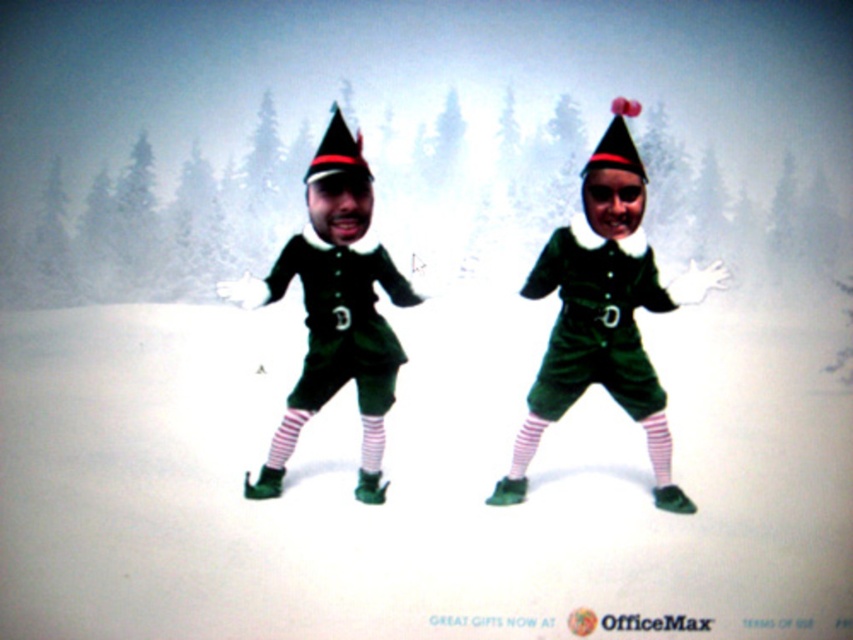
Question: Among these objects, which one is farthest from the camera?

Choices:
 (A) matte black christmas hat at upper center
 (B) white matte snow at center
 (C) green velvet elf at center

Answer: (C)

Question: Where is green velvet elf at center located in relation to matte green fabric christmas hat at center in the image?

Choices:
 (A) right
 (B) left

Answer: (A)

Question: Does green velvet elf at center have a lesser width compared to matte green fabric christmas hat at center?

Choices:
 (A) no
 (B) yes

Answer: (A)

Question: Which object is positioned farthest from the white striped sock at center?

Choices:
 (A) matte green fabric christmas hat at center
 (B) white matte snow at center
 (C) green velvet elf at center

Answer: (A)

Question: Which point is farther to the camera?

Choices:
 (A) green velvet elf at center
 (B) green matte elf costume at center
 (C) matte green fabric christmas hat at center

Answer: (B)

Question: Does green velvet elf at center appear on the right side of matte black christmas hat at upper center?

Choices:
 (A) yes
 (B) no

Answer: (A)